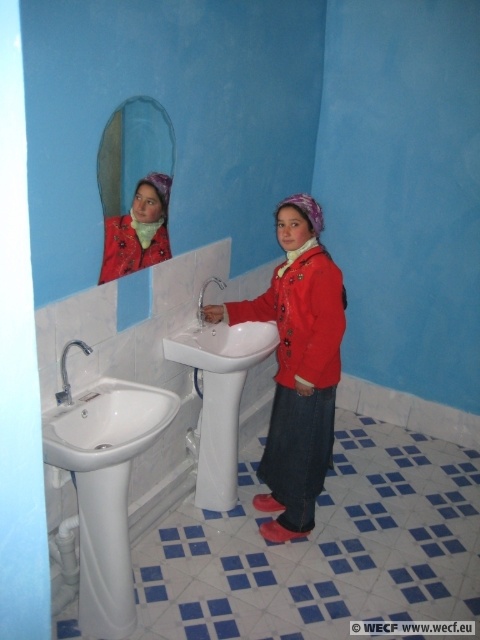
Is matte red jacket at center further to camera compared to brushed metal faucet at sink left?

That is True.

Between point (294, 348) and point (67, 403), which one is positioned behind?

Positioned behind is point (294, 348).

Identify the location of matte red jacket at center. The height and width of the screenshot is (640, 480). (298, 365).

Can you confirm if matte red jacket at center is thinner than silver metallic faucet at sink left?

No.

Between point (302, 195) and point (197, 308), which one is positioned behind?

The point (197, 308) is behind.

I want to click on matte red jacket at center, so click(298, 365).

Find the location of a particular element. matte red jacket at center is located at coordinates (298, 365).

Between brushed metal faucet at sink left and silver metallic faucet at sink left, which one has less height?

Standing shorter between the two is brushed metal faucet at sink left.

Is brushed metal faucet at sink left to the left of silver metallic faucet at sink left from the viewer's perspective?

Indeed, brushed metal faucet at sink left is positioned on the left side of silver metallic faucet at sink left.

Is point (66, 355) positioned behind point (202, 305)?

No, (66, 355) is in front of (202, 305).

Find the location of a particular element. brushed metal faucet at sink left is located at coordinates (67, 372).